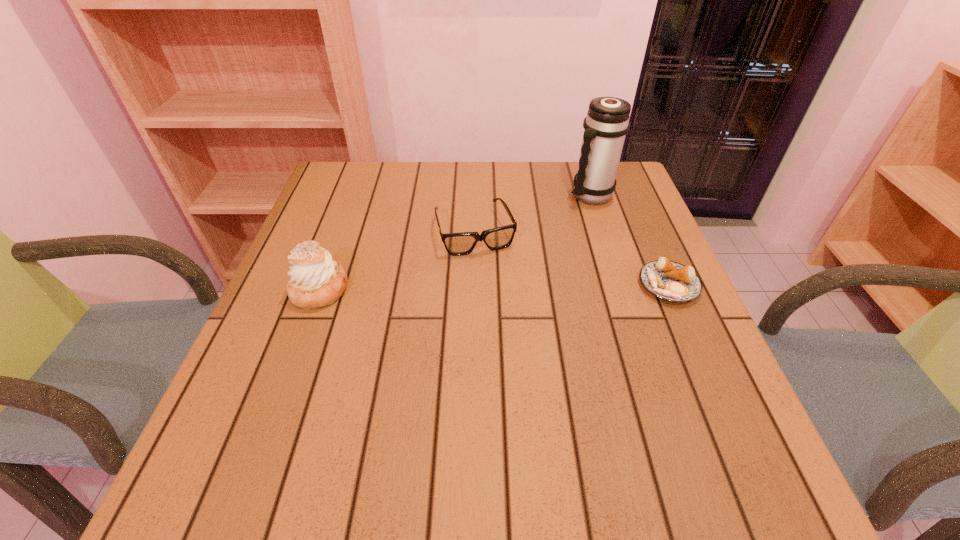
Image resolution: width=960 pixels, height=540 pixels. What are the coordinates of `the second tallest object` in the screenshot? It's located at (316, 280).

Locate an element on the screen. The image size is (960, 540). the taller pastry is located at coordinates (316, 280).

Locate an element on the screen. the shorter pastry is located at coordinates (667, 280).

Identify the location of the shortest object. The width and height of the screenshot is (960, 540). (667, 280).

Where is `sunglasses`? sunglasses is located at coordinates (456, 244).

Image resolution: width=960 pixels, height=540 pixels. I want to click on the second object from left to right, so click(x=456, y=244).

You are a GUI agent. You are given a task and a screenshot of the screen. Output one action in this format:
    pyautogui.click(x=<x>, y=<y>)
    Task: Click on the farthest object
    This screenshot has height=540, width=960.
    Given the screenshot: What is the action you would take?
    pyautogui.click(x=607, y=122)

Find the location of `thermos bottle`. thermos bottle is located at coordinates (607, 122).

At what (x,y) coordinates should I click in order to perform the action: click on free location located 0.100m on the back of the left pastry. Please return your answer as a coordinate pair (x, y). Looking at the image, I should click on click(337, 241).

Where is `vacant space located 0.210m on the front of the shortest object`? This screenshot has height=540, width=960. vacant space located 0.210m on the front of the shortest object is located at coordinates (716, 396).